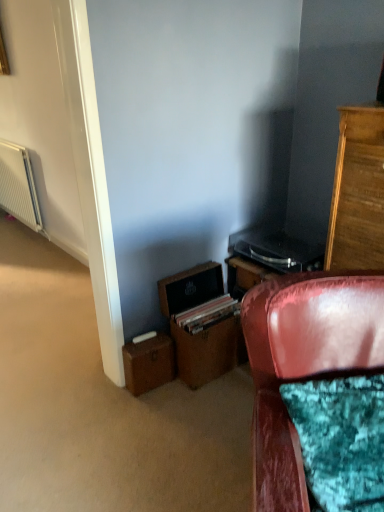
Locate an element on the screen. Image resolution: width=384 pixels, height=512 pixels. brown cardboard drawer at lower center is located at coordinates (205, 352).

Measure the distance between point (188, 342) and camera.

The depth of point (188, 342) is 6.13 feet.

Image resolution: width=384 pixels, height=512 pixels. Identify the location of velvet red chair at lower right. (304, 362).

Image resolution: width=384 pixels, height=512 pixels. What do you see at coordinates (18, 185) in the screenshot?
I see `white textured radiator at left` at bounding box center [18, 185].

Image resolution: width=384 pixels, height=512 pixels. I want to click on brown cardboard drawer at lower center, so click(x=205, y=352).

From their relative heights in the image, would you say brown cardboard drawer at lower center is taller or shorter than white textured radiator at left?

In the image, brown cardboard drawer at lower center appears to be shorter than white textured radiator at left.

Consider the image. In terms of width, does brown cardboard drawer at lower center look wider or thinner when compared to white textured radiator at left?

In the image, brown cardboard drawer at lower center appears to be wider than white textured radiator at left.

Could white textured radiator at left be considered to be inside brown cardboard drawer at lower center?

No, brown cardboard drawer at lower center does not contain white textured radiator at left.

Which is in front, point (4, 148) or point (150, 375)?

Positioned in front is point (150, 375).

Looking at this image, is white textured radiator at left in front of brown cardboard box at lower left?

No, white textured radiator at left is behind brown cardboard box at lower left.

Between white textured radiator at left and brown cardboard box at lower left, which one appears on the right side from the viewer's perspective?

brown cardboard box at lower left.

Is brown cardboard box at lower left looking in the opposite direction of brown leather file cabinet at lower center?

No, brown leather file cabinet at lower center is not at the back of brown cardboard box at lower left.

Is brown cardboard box at lower left further to the viewer compared to brown leather file cabinet at lower center?

Yes, brown cardboard box at lower left is further from the camera.

Who is smaller, brown cardboard box at lower left or brown leather file cabinet at lower center?

With smaller size is brown cardboard box at lower left.

Considering the positions of objects brown cardboard box at lower left and brown leather file cabinet at lower center in the image provided, who is more to the left, brown cardboard box at lower left or brown leather file cabinet at lower center?

Positioned to the left is brown cardboard box at lower left.

Which object is positioned more to the right, white textured radiator at left or velvet red chair at lower right?

velvet red chair at lower right.

Between white textured radiator at left and velvet red chair at lower right, which one has larger width?

velvet red chair at lower right is wider.

What's the angular difference between white textured radiator at left and velvet red chair at lower right's facing directions?

white textured radiator at left and velvet red chair at lower right are facing 45 degrees away from each other.

From the image's perspective, does white textured radiator at left appear higher than velvet red chair at lower right?

Yes, from the image's perspective, white textured radiator at left is on top of velvet red chair at lower right.

The image size is (384, 512). What are the coordinates of `chair in front of the brown cardboard drawer at lower center` in the screenshot? It's located at (304, 362).

Can you confirm if velvet red chair at lower right is wider than brown cardboard drawer at lower center?

Indeed, velvet red chair at lower right has a greater width compared to brown cardboard drawer at lower center.

From a real-world perspective, is velvet red chair at lower right on top of brown cardboard drawer at lower center?

Yes, from a real-world perspective, velvet red chair at lower right is above brown cardboard drawer at lower center.

Is velvet red chair at lower right placed right next to brown cardboard drawer at lower center?

No, velvet red chair at lower right is not beside brown cardboard drawer at lower center.

Does point (185, 364) come behind point (161, 350)?

Yes, it is behind point (161, 350).

Which of these two, brown cardboard drawer at lower center or brown cardboard box at lower left, is wider?

With larger width is brown cardboard drawer at lower center.

Can you confirm if brown cardboard drawer at lower center is positioned to the left of brown cardboard box at lower left?

No.

Does brown cardboard drawer at lower center turn towards brown cardboard box at lower left?

No.

From the image's perspective, does brown cardboard box at lower left appear lower than velvet red chair at lower right?

No, from the image's perspective, brown cardboard box at lower left is not below velvet red chair at lower right.

Is velvet red chair at lower right at the back of brown cardboard box at lower left?

brown cardboard box at lower left is not turned away from velvet red chair at lower right.

Considering the relative sizes of brown cardboard box at lower left and velvet red chair at lower right in the image provided, is brown cardboard box at lower left thinner than velvet red chair at lower right?

Indeed, brown cardboard box at lower left has a lesser width compared to velvet red chair at lower right.

Where is `drawer below the white textured radiator at left (from the image's perspective)`? The image size is (384, 512). drawer below the white textured radiator at left (from the image's perspective) is located at coordinates (205, 352).

Locate an element on the screen. The image size is (384, 512). cardboard box beneath the white textured radiator at left (from a real-world perspective) is located at coordinates (148, 364).

Which object lies further to the anchor point white textured radiator at left, brown leather file cabinet at lower center or brown cardboard box at lower left?

brown cardboard box at lower left is positioned further to the anchor white textured radiator at left.

Which object lies nearer to the anchor point brown leather file cabinet at lower center, white textured radiator at left or velvet red chair at lower right?

velvet red chair at lower right.

Consider the image. Based on their spatial positions, is wooden cabinet at right or brown cardboard box at lower left further from brown leather file cabinet at lower center?

The object further to brown leather file cabinet at lower center is wooden cabinet at right.

Considering their positions, is velvet red chair at lower right positioned closer to white textured radiator at left than brown cardboard box at lower left?

brown cardboard box at lower left is closer to white textured radiator at left.

Which object lies nearer to the anchor point brown cardboard drawer at lower center, brown cardboard box at lower left or white textured radiator at left?

brown cardboard box at lower left lies closer to brown cardboard drawer at lower center than the other object.

Looking at the image, which one is located further to white textured radiator at left, brown cardboard drawer at lower center or wooden cabinet at right?

wooden cabinet at right is further to white textured radiator at left.

Looking at the image, which one is located closer to brown cardboard box at lower left, white textured radiator at left or velvet red chair at lower right?

velvet red chair at lower right lies closer to brown cardboard box at lower left than the other object.

Looking at the image, which one is located further to white textured radiator at left, velvet red chair at lower right or brown cardboard drawer at lower center?

The object further to white textured radiator at left is velvet red chair at lower right.

This screenshot has width=384, height=512. In order to click on cardboard box between velvet red chair at lower right and brown cardboard drawer at lower center along the z-axis in this screenshot , I will do `click(148, 364)`.

Locate an element on the screen. cardboard box between white textured radiator at left and brown cardboard drawer at lower center from left to right is located at coordinates (148, 364).

This screenshot has height=512, width=384. Identify the location of cabinetry between velvet red chair at lower right and brown cardboard box at lower left along the z-axis. (358, 192).

The height and width of the screenshot is (512, 384). I want to click on drawer between velvet red chair at lower right and white textured radiator at left along the z-axis, so coord(205,352).